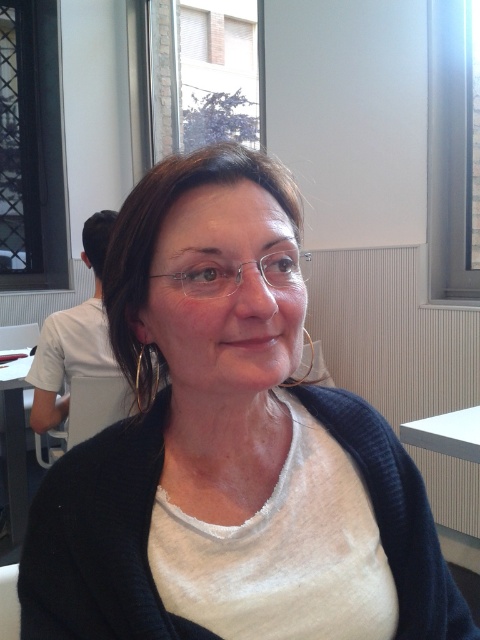
You are a photographer trying to capture the clear plastic glasses at center without the metallic mesh window at upper left obstructing the view. Is this possible given their positions?

The clear plastic glasses at center is behind the metallic mesh window at upper left, so the window would block the direct view of the glasses. You cannot capture the glasses without the window obstructing the view.

You are trying to decide whether to place a large painting on the matte glass window at upper center or the white glossy table at lower left. Based on their sizes, which surface can accommodate the painting better?

The matte glass window at upper center might be wider than the white glossy table at lower left, so it can accommodate the painting better.

You are a window installer assessing the space. The metallic mesh window at upper left needs to be replaced with a new one of the same height. You have a template of the clear plastic glasses at center. Can you use the template to determine the required height for the new window?

The metallic mesh window at upper left is taller than clear plastic glasses at center, so the template of the clear plastic glasses at center would not be sufficient to determine the required height for the new window since it is shorter.